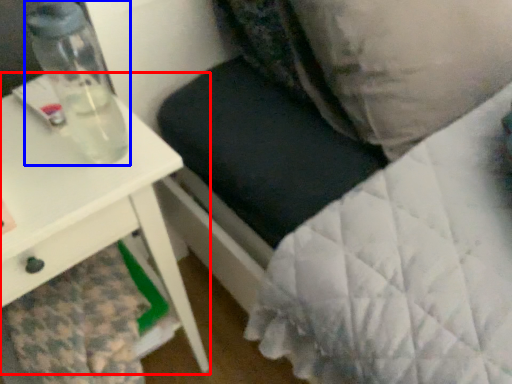
Question: Which point is further to the camera, table (highlighted by a red box) or bottle (highlighted by a blue box)?

Choices:
 (A) table
 (B) bottle

Answer: (B)